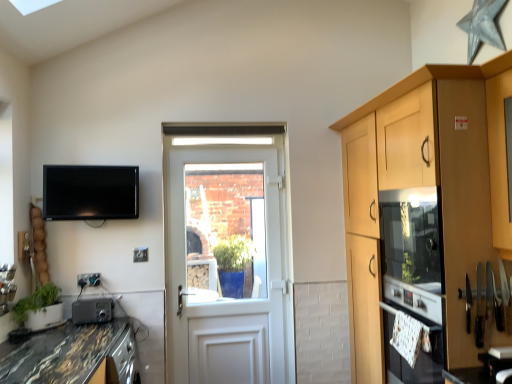
Question: From a real-world perspective, is matte wood oven at right over marble/black granite countertop at lower left?

Choices:
 (A) no
 (B) yes

Answer: (B)

Question: Considering the relative sizes of matte wood oven at right and marble/black granite countertop at lower left in the image provided, is matte wood oven at right smaller than marble/black granite countertop at lower left?

Choices:
 (A) no
 (B) yes

Answer: (A)

Question: Is matte wood oven at right wider than marble/black granite countertop at lower left?

Choices:
 (A) yes
 (B) no

Answer: (B)

Question: Is matte wood oven at right aimed at marble/black granite countertop at lower left?

Choices:
 (A) no
 (B) yes

Answer: (B)

Question: Considering the relative sizes of matte wood oven at right and marble/black granite countertop at lower left in the image provided, is matte wood oven at right thinner than marble/black granite countertop at lower left?

Choices:
 (A) no
 (B) yes

Answer: (B)

Question: From the image's perspective, is marble/black granite countertop at lower left located above or below green matte plant at lower left?

Choices:
 (A) below
 (B) above

Answer: (A)

Question: Considering the positions of marble/black granite countertop at lower left and green matte plant at lower left in the image, is marble/black granite countertop at lower left taller or shorter than green matte plant at lower left?

Choices:
 (A) short
 (B) tall

Answer: (B)

Question: In the image, is marble/black granite countertop at lower left on the left side or the right side of green matte plant at lower left?

Choices:
 (A) left
 (B) right

Answer: (B)

Question: In terms of size, does marble/black granite countertop at lower left appear bigger or smaller than green matte plant at lower left?

Choices:
 (A) big
 (B) small

Answer: (A)

Question: Is clear glass door at center wider or thinner than marble/black granite countertop at lower left?

Choices:
 (A) wide
 (B) thin

Answer: (B)

Question: Visually, is clear glass door at center positioned to the left or to the right of marble/black granite countertop at lower left?

Choices:
 (A) left
 (B) right

Answer: (B)

Question: Which is correct: clear glass door at center is inside marble/black granite countertop at lower left, or outside of it?

Choices:
 (A) outside
 (B) inside

Answer: (A)

Question: Considering their positions, is clear glass door at center located in front of or behind marble/black granite countertop at lower left?

Choices:
 (A) behind
 (B) front

Answer: (A)

Question: In terms of height, does matte wood oven at right look taller or shorter compared to clear glass door at center?

Choices:
 (A) short
 (B) tall

Answer: (B)

Question: In terms of size, does matte wood oven at right appear bigger or smaller than clear glass door at center?

Choices:
 (A) big
 (B) small

Answer: (A)